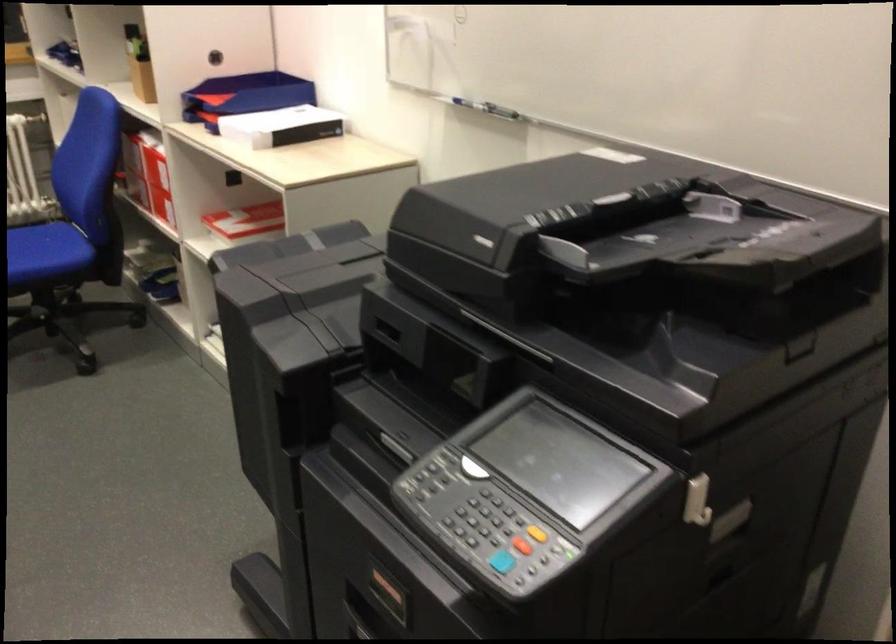
This screenshot has width=896, height=644. What do you see at coordinates (521, 545) in the screenshot?
I see `the orange printer button` at bounding box center [521, 545].